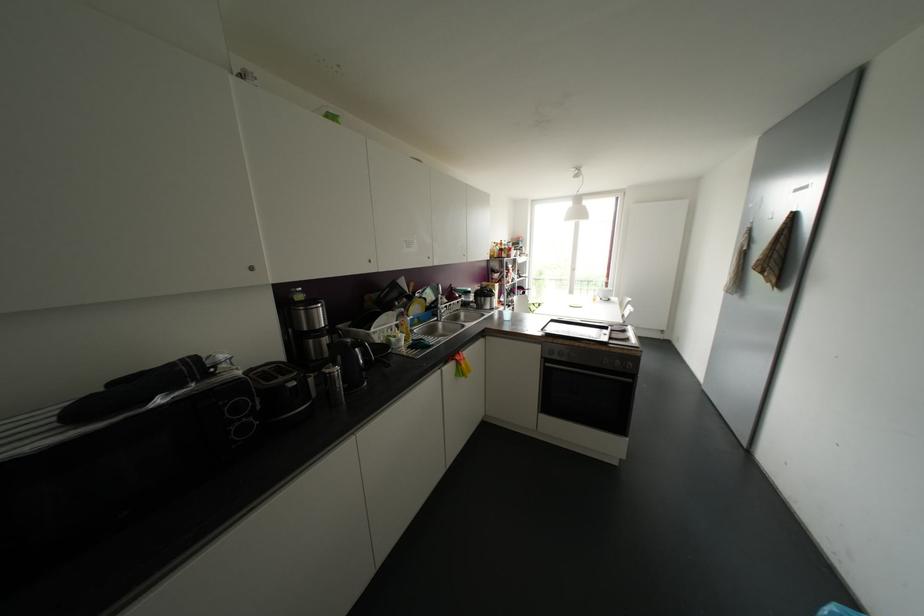
The width and height of the screenshot is (924, 616). What are the coordinates of `black kettle handle` in the screenshot? It's located at (375, 350).